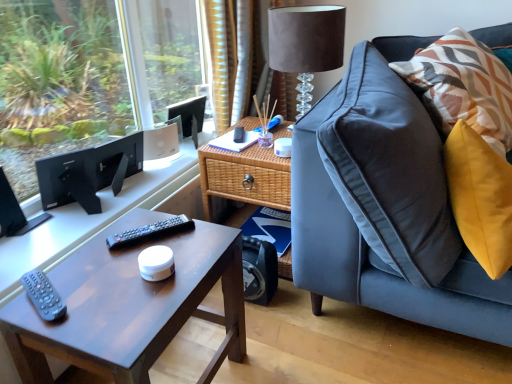
This screenshot has height=384, width=512. Identify the location of empty space that is to the right of black matte computer monitor at left. (115, 205).